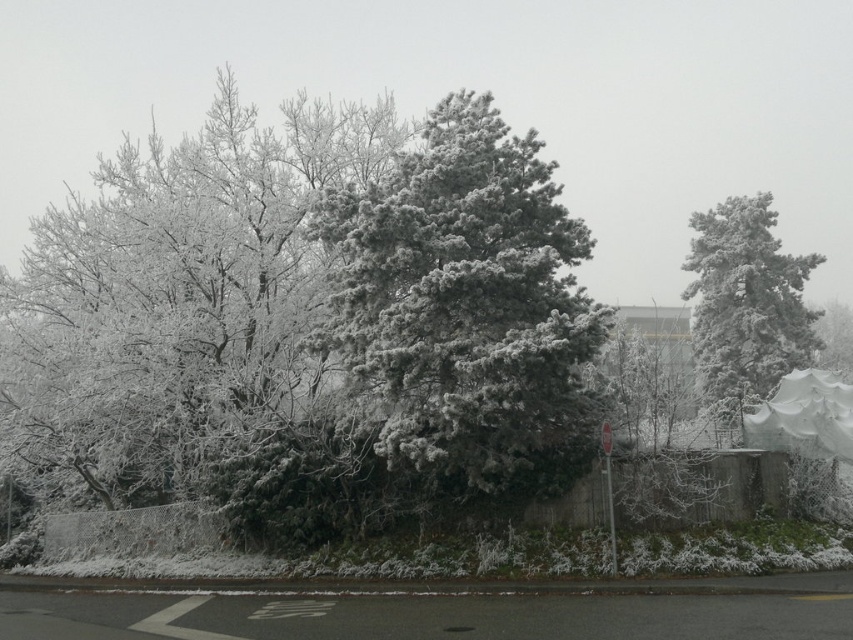
Describe the element at coordinates (173, 298) in the screenshot. I see `white frosty tree at left` at that location.

Which is more to the right, white frosty tree at left or snow-covered pine tree at right?

From the viewer's perspective, snow-covered pine tree at right appears more on the right side.

Is point (12, 400) positioned behind point (744, 308)?

No.

This screenshot has height=640, width=853. In order to click on white frosty tree at left in this screenshot , I will do `click(173, 298)`.

Is point (573, 481) closer to camera compared to point (694, 292)?

Yes, it is.

I want to click on snow-covered pine tree at center, so click(x=466, y=308).

Between snow-covered pine tree at center and white fabric canopy at lower right, which one has less height?

Standing shorter between the two is snow-covered pine tree at center.

Which is behind, point (436, 243) or point (762, 412)?

The point (762, 412) is behind.

I want to click on snow-covered pine tree at center, so click(x=466, y=308).

Identify the location of snow-covered pine tree at center. This screenshot has height=640, width=853. (466, 308).